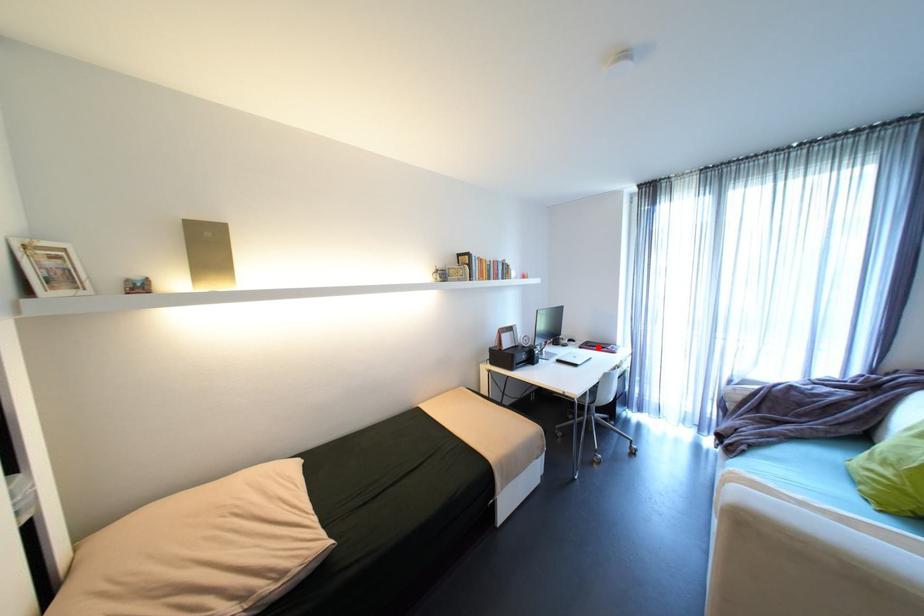
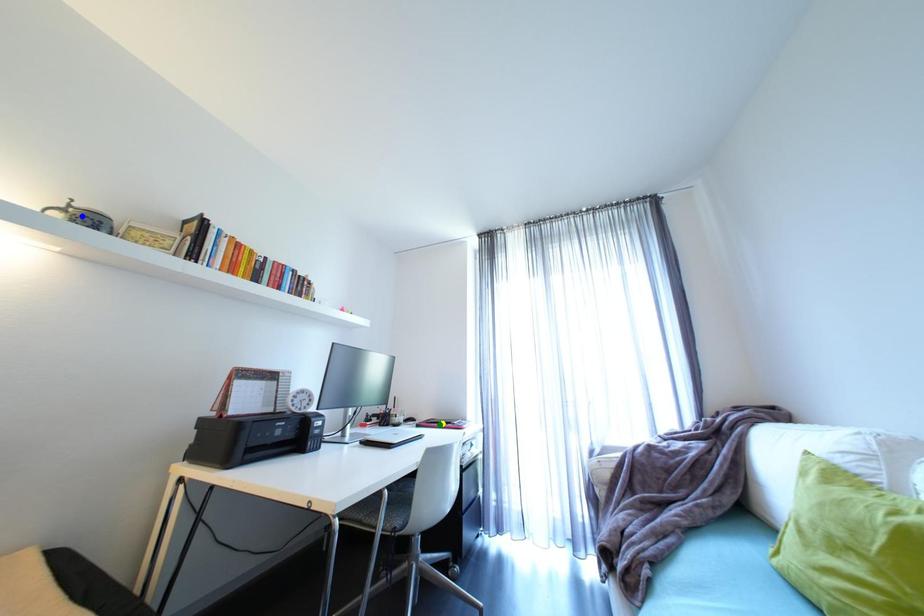
Question: I am providing you with two images of the same scene from different viewpoints. A red point is marked on the first image. You are given multiple points on the second image. Which spot in image 2 lines up with the point in image 1?

Choices:
 (A) yellow point
 (B) green point
 (C) blue point

Answer: (B)